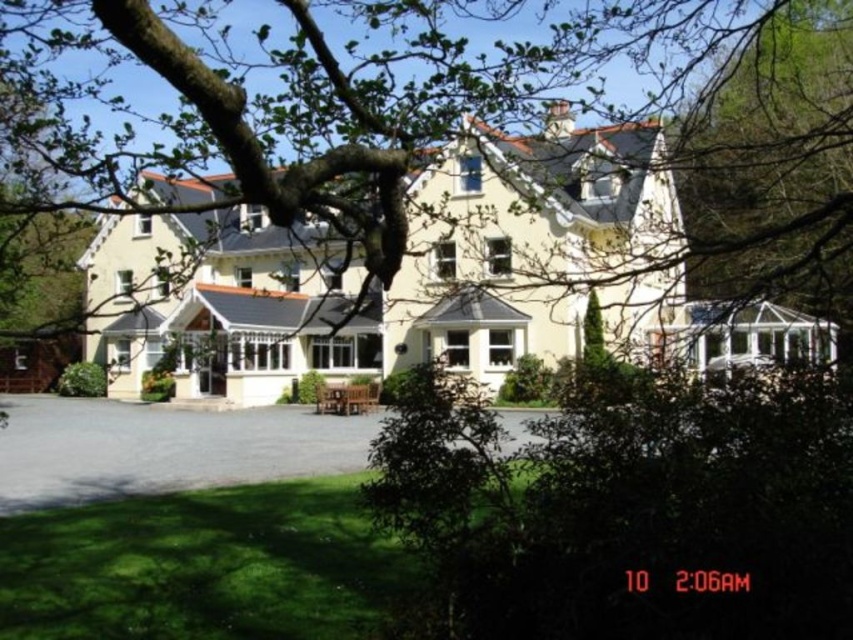
Question: Which point is closer to the camera?

Choices:
 (A) gray asphalt driveway at lower center
 (B) yellow matte building at center

Answer: (B)

Question: Does yellow matte building at center appear on the right side of gray asphalt driveway at lower center?

Choices:
 (A) no
 (B) yes

Answer: (B)

Question: Which of the following is the farthest from the observer?

Choices:
 (A) gray asphalt driveway at lower center
 (B) yellow matte building at center

Answer: (A)

Question: Is yellow matte building at center further to the viewer compared to gray asphalt driveway at lower center?

Choices:
 (A) no
 (B) yes

Answer: (A)

Question: Does yellow matte building at center appear on the left side of gray asphalt driveway at lower center?

Choices:
 (A) no
 (B) yes

Answer: (A)

Question: Among these objects, which one is farthest from the camera?

Choices:
 (A) yellow matte building at center
 (B) gray asphalt driveway at lower center

Answer: (B)